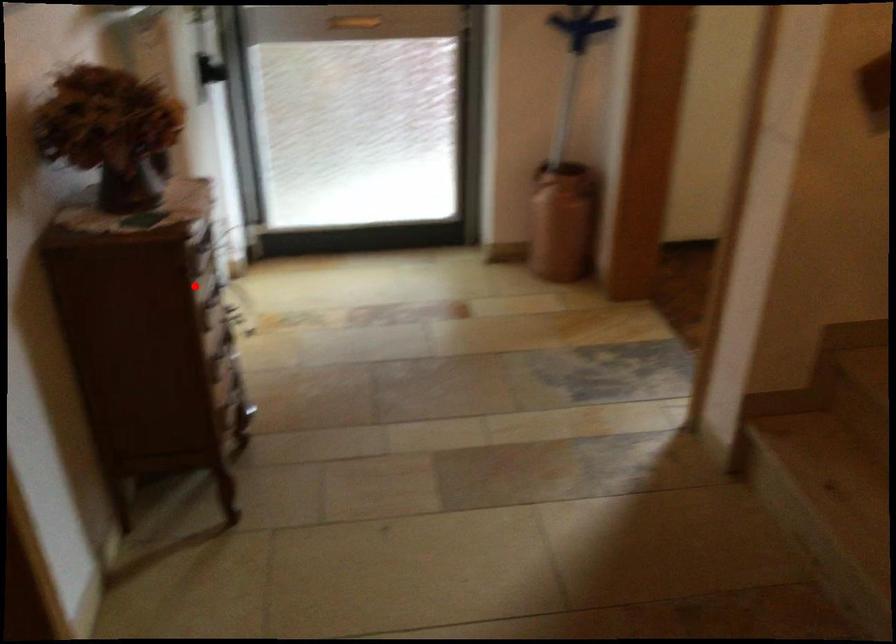
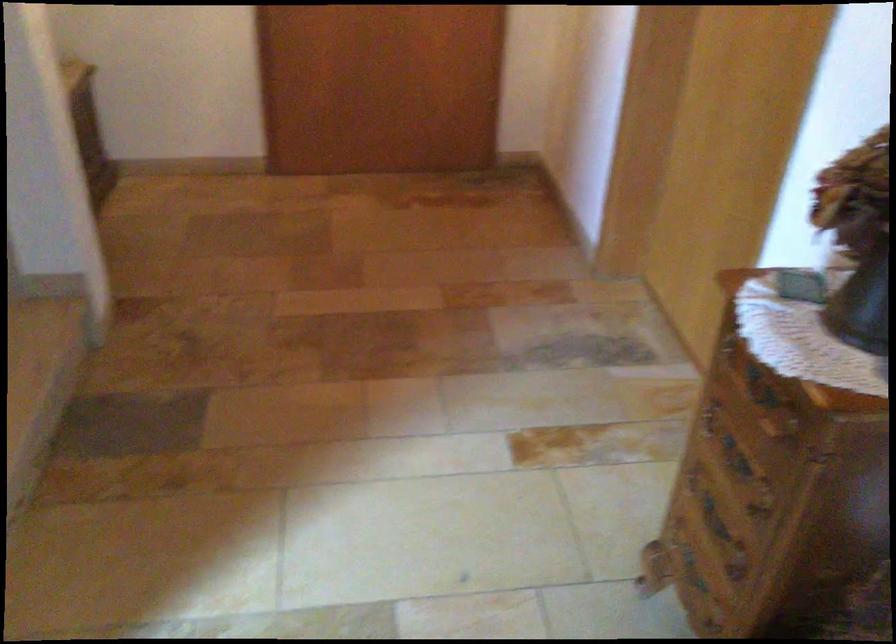
Locate, in the second image, the point that corresponds to the highlighted location in the first image.

(760, 386)